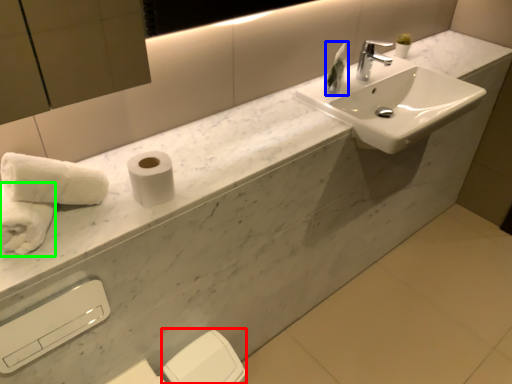
Question: Which is farther away from toilet paper (highlighted by a red box)? toiletry (highlighted by a blue box) or bath towel (highlighted by a green box)?

Choices:
 (A) toiletry
 (B) bath towel

Answer: (A)